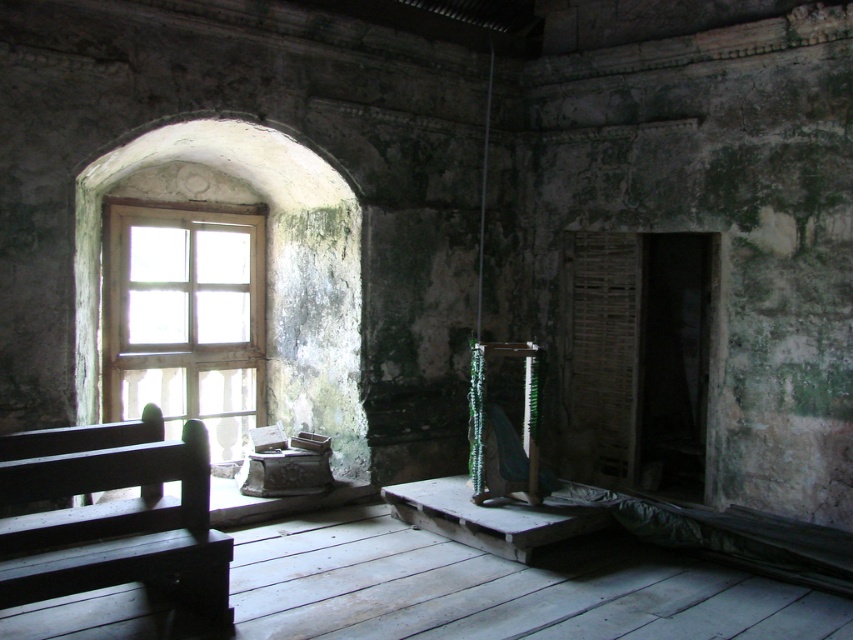
Does dark wood bench at left have a lesser height compared to wooden at left?

Correct, dark wood bench at left is not as tall as wooden at left.

Is dark wood bench at left behind wooden at left?

No, dark wood bench at left is closer to the viewer.

Locate an element on the screen. The height and width of the screenshot is (640, 853). dark wood bench at left is located at coordinates (111, 515).